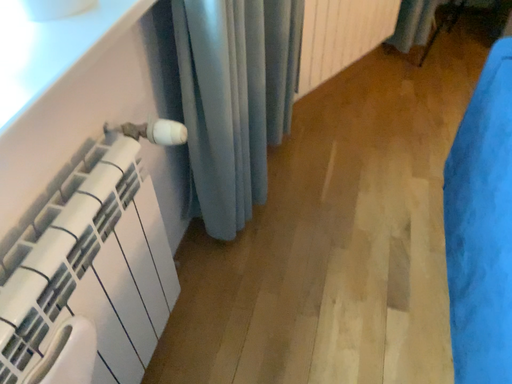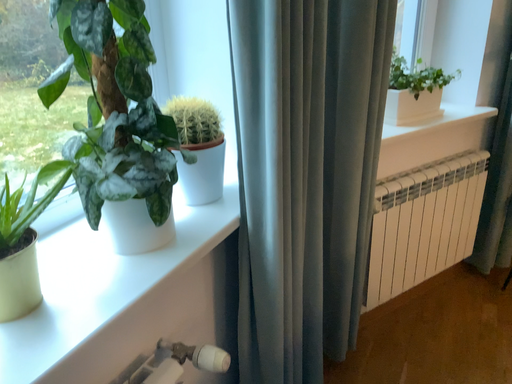
Question: How did the camera likely rotate when shooting the video?

Choices:
 (A) rotated right
 (B) rotated left

Answer: (B)